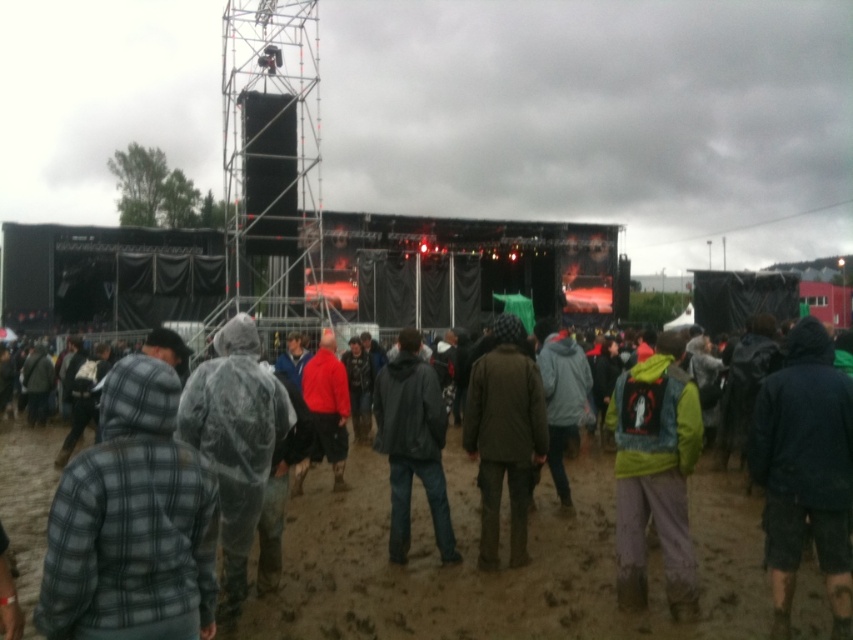
Question: Is dark blue jacket at center smaller than green matte jacket at center?

Choices:
 (A) no
 (B) yes

Answer: (B)

Question: Is plaid fabric jacket at center wider than dark blue jacket at center?

Choices:
 (A) no
 (B) yes

Answer: (B)

Question: Which point is closer to the camera taking this photo?

Choices:
 (A) (318, 369)
 (B) (653, 520)

Answer: (B)

Question: Is plaid wool jacket at lower left to the left of dark brown leather jacket at center from the viewer's perspective?

Choices:
 (A) no
 (B) yes

Answer: (B)

Question: Which point appears farthest from the camera in this image?

Choices:
 (A) (245, 342)
 (B) (791, 410)
 (C) (416, 388)

Answer: (C)

Question: Which object is positioned closest to the dark blue jacket at center?

Choices:
 (A) plaid fabric jacket at center
 (B) dark gray jacket at center
 (C) clear plastic raincoat at center

Answer: (B)